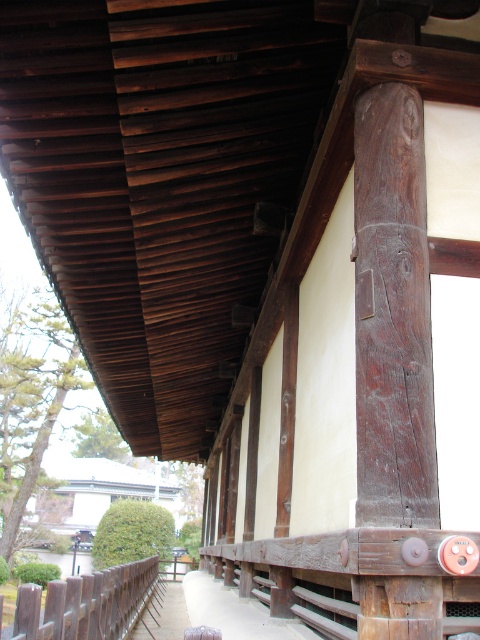
Question: Can you confirm if dark brown wood at center is bigger than brown wooden rail at lower left?

Choices:
 (A) yes
 (B) no

Answer: (B)

Question: Can you confirm if dark brown wood at center is smaller than brown wooden rail at lower left?

Choices:
 (A) no
 (B) yes

Answer: (B)

Question: Which of the following is the farthest from the observer?

Choices:
 (A) dark brown wood at center
 (B) brown wooden rail at lower left

Answer: (B)

Question: Is dark brown wood at center further to camera compared to brown wooden rail at lower left?

Choices:
 (A) yes
 (B) no

Answer: (B)

Question: Among these points, which one is nearest to the camera?

Choices:
 (A) (405, 632)
 (B) (123, 588)

Answer: (A)